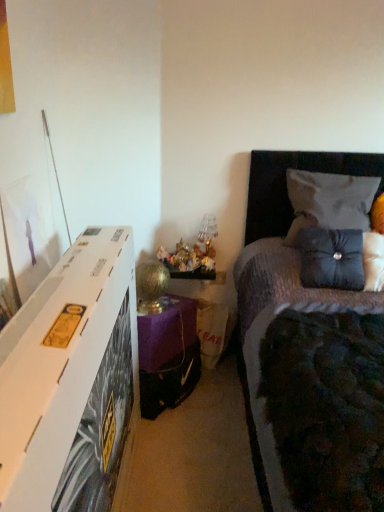
Question: From a real-world perspective, is gold metallic table lamp at lower center located beneath velvet gray pillow at upper right, the second pillow positioned from the bottom?

Choices:
 (A) no
 (B) yes

Answer: (B)

Question: Would you consider gold metallic table lamp at lower center to be distant from velvet gray pillow at upper right, the second pillow positioned from the bottom?

Choices:
 (A) yes
 (B) no

Answer: (B)

Question: Considering the relative sizes of gold metallic table lamp at lower center and velvet gray pillow at upper right, placed as the 1th pillow when sorted from top to bottom, in the image provided, is gold metallic table lamp at lower center taller than velvet gray pillow at upper right, placed as the 1th pillow when sorted from top to bottom,?

Choices:
 (A) yes
 (B) no

Answer: (B)

Question: From the image's perspective, is gold metallic table lamp at lower center located beneath velvet gray pillow at upper right, the second pillow positioned from the bottom?

Choices:
 (A) yes
 (B) no

Answer: (A)

Question: From the image's perspective, is gold metallic table lamp at lower center over velvet gray pillow at upper right, placed as the 1th pillow when sorted from top to bottom?

Choices:
 (A) no
 (B) yes

Answer: (A)

Question: From a real-world perspective, is gold metallic table lamp at lower center positioned above or below purple fabric nightstand at lower center?

Choices:
 (A) below
 (B) above

Answer: (B)

Question: Is gold metallic table lamp at lower center inside the boundaries of purple fabric nightstand at lower center, or outside?

Choices:
 (A) outside
 (B) inside

Answer: (A)

Question: Does point (152, 298) appear closer or farther from the camera than point (150, 334)?

Choices:
 (A) farther
 (B) closer

Answer: (A)

Question: In terms of size, does gold metallic table lamp at lower center appear bigger or smaller than purple fabric nightstand at lower center?

Choices:
 (A) big
 (B) small

Answer: (B)

Question: Relative to velvet gray pillow at upper right, the second pillow positioned from the bottom, is purple fabric nightstand at lower center in front or behind?

Choices:
 (A) behind
 (B) front

Answer: (B)

Question: Considering the positions of purple fabric nightstand at lower center and velvet gray pillow at upper right, the second pillow positioned from the bottom, in the image, is purple fabric nightstand at lower center bigger or smaller than velvet gray pillow at upper right, the second pillow positioned from the bottom,?

Choices:
 (A) big
 (B) small

Answer: (B)

Question: Do you think purple fabric nightstand at lower center is within velvet gray pillow at upper right, placed as the 1th pillow when sorted from top to bottom, or outside of it?

Choices:
 (A) inside
 (B) outside

Answer: (B)

Question: In terms of height, does purple fabric nightstand at lower center look taller or shorter compared to velvet gray pillow at upper right, placed as the 1th pillow when sorted from top to bottom?

Choices:
 (A) tall
 (B) short

Answer: (B)

Question: Would you say velvet gray pillow at upper right, placed as the 1th pillow when sorted from top to bottom, is inside or outside gold metallic table lamp at lower center?

Choices:
 (A) inside
 (B) outside

Answer: (B)

Question: Relative to gold metallic table lamp at lower center, is velvet gray pillow at upper right, placed as the 1th pillow when sorted from top to bottom, in front or behind?

Choices:
 (A) front
 (B) behind

Answer: (A)